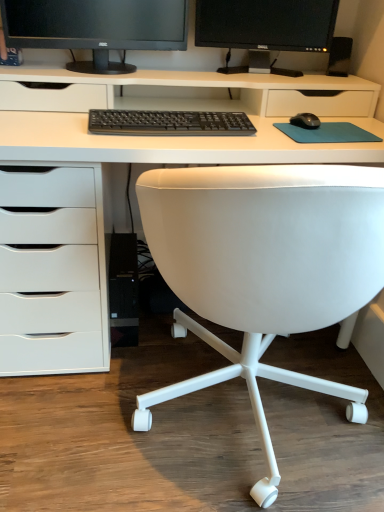
Question: Is black matte monitor at upper center, the 1th computer monitor when ordered from left to right, shorter than white leather chair at center?

Choices:
 (A) no
 (B) yes

Answer: (B)

Question: Considering the relative sizes of black matte monitor at upper center, arranged as the second computer monitor when viewed from the right, and white leather chair at center in the image provided, is black matte monitor at upper center, arranged as the second computer monitor when viewed from the right, thinner than white leather chair at center?

Choices:
 (A) yes
 (B) no

Answer: (A)

Question: Does black matte monitor at upper center, the 1th computer monitor when ordered from left to right, have a greater height compared to white leather chair at center?

Choices:
 (A) no
 (B) yes

Answer: (A)

Question: Are black matte monitor at upper center, arranged as the second computer monitor when viewed from the right, and white leather chair at center making contact?

Choices:
 (A) yes
 (B) no

Answer: (B)

Question: Considering the relative sizes of black matte monitor at upper center, arranged as the second computer monitor when viewed from the right, and white leather chair at center in the image provided, is black matte monitor at upper center, arranged as the second computer monitor when viewed from the right, bigger than white leather chair at center?

Choices:
 (A) no
 (B) yes

Answer: (A)

Question: From a real-world perspective, is black matte monitor at upper center, the 1th computer monitor when ordered from left to right, over white leather chair at center?

Choices:
 (A) no
 (B) yes

Answer: (B)

Question: From the image's perspective, is black plastic speaker at upper right under black plastic keyboard at center?

Choices:
 (A) no
 (B) yes

Answer: (A)

Question: Is black plastic speaker at upper right thinner than black plastic keyboard at center?

Choices:
 (A) yes
 (B) no

Answer: (A)

Question: Is black plastic speaker at upper right bigger than black plastic keyboard at center?

Choices:
 (A) yes
 (B) no

Answer: (B)

Question: Would you say black plastic keyboard at center is part of black plastic speaker at upper right's contents?

Choices:
 (A) no
 (B) yes

Answer: (A)

Question: Does black plastic speaker at upper right have a greater height compared to black plastic keyboard at center?

Choices:
 (A) no
 (B) yes

Answer: (B)

Question: Is black plastic speaker at upper right oriented towards black plastic keyboard at center?

Choices:
 (A) no
 (B) yes

Answer: (A)

Question: Can you confirm if black matte monitor at upper center, the 1th computer monitor when ordered from left to right, is positioned to the left of teal fabric mousepad at center?

Choices:
 (A) yes
 (B) no

Answer: (A)